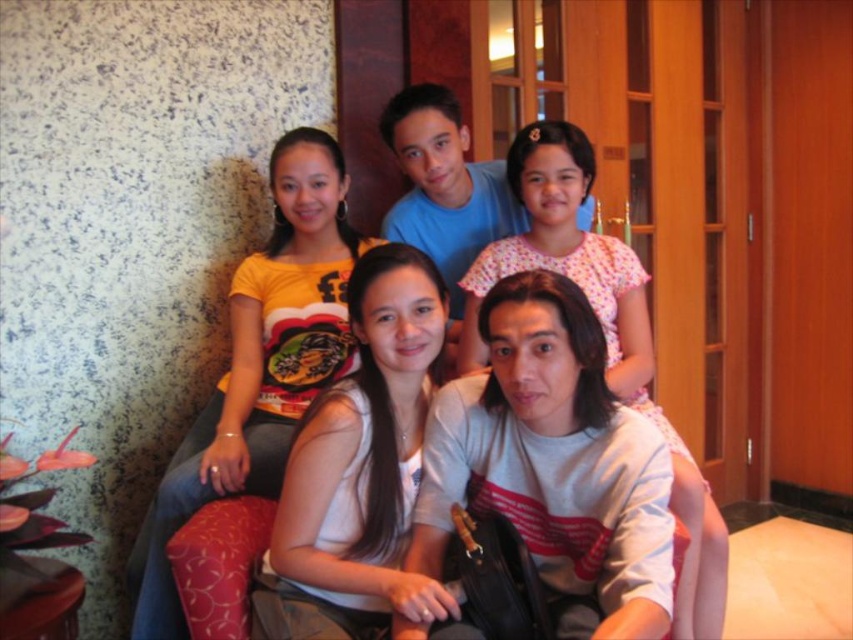
Question: Is white matte shirt at center wider than yellow printed t-shirt at upper left?

Choices:
 (A) yes
 (B) no

Answer: (B)

Question: Is white matte shirt at center wider than yellow printed t-shirt at upper left?

Choices:
 (A) no
 (B) yes

Answer: (A)

Question: Is yellow printed t-shirt at upper left bigger than pink floral dress at upper center?

Choices:
 (A) yes
 (B) no

Answer: (B)

Question: Based on their relative distances, which object is nearer to the pink floral dress at upper center?

Choices:
 (A) matte blue shirt at upper center
 (B) white matte shirt at center

Answer: (A)

Question: Which of the following is the farthest from the observer?

Choices:
 (A) pink floral dress at upper center
 (B) white matte shirt at center

Answer: (A)

Question: Which object appears closest to the camera in this image?

Choices:
 (A) pink floral dress at upper center
 (B) white matte shirt at center
 (C) yellow printed t-shirt at upper left
 (D) matte blue shirt at upper center

Answer: (B)